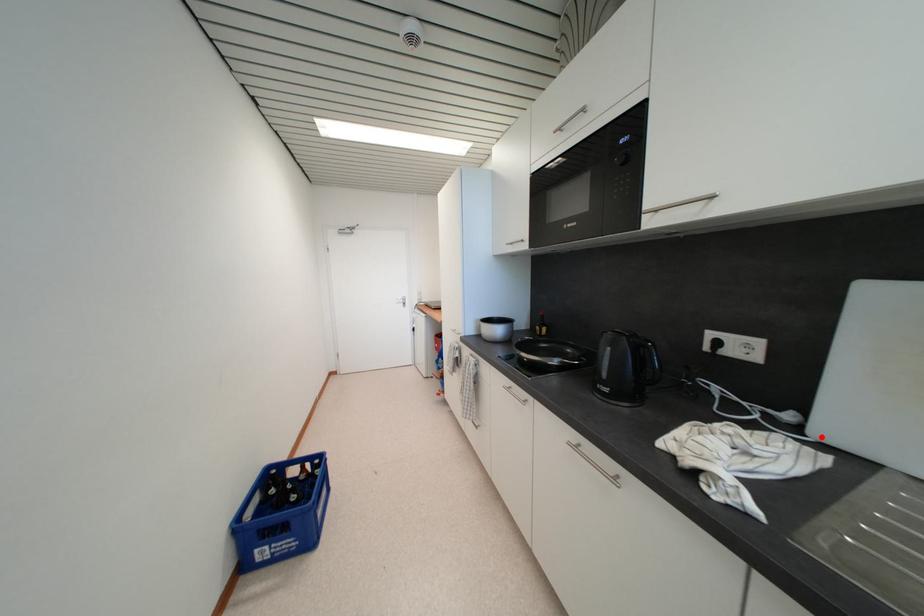
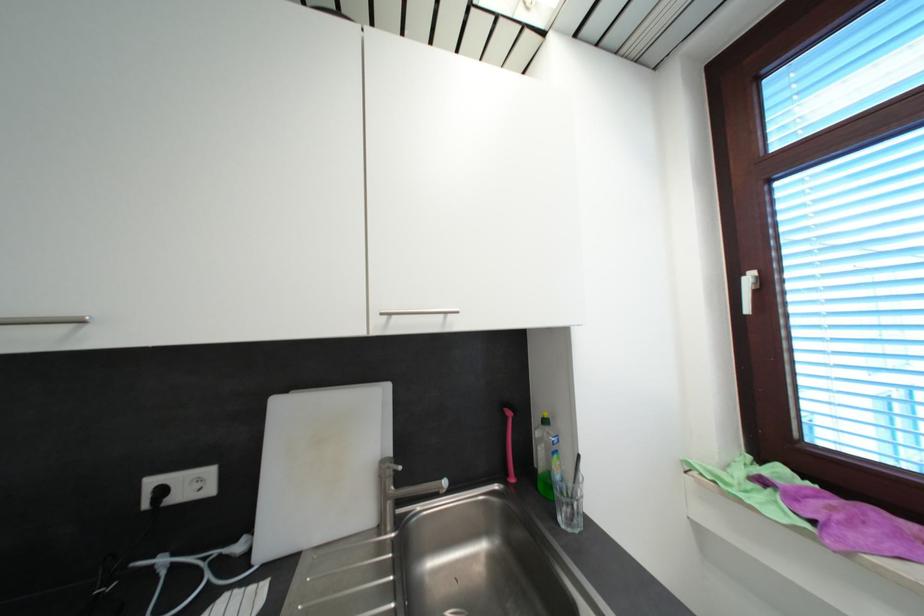
Where in the second image is the point corresponding to the highlighted location from the first image?

(265, 559)